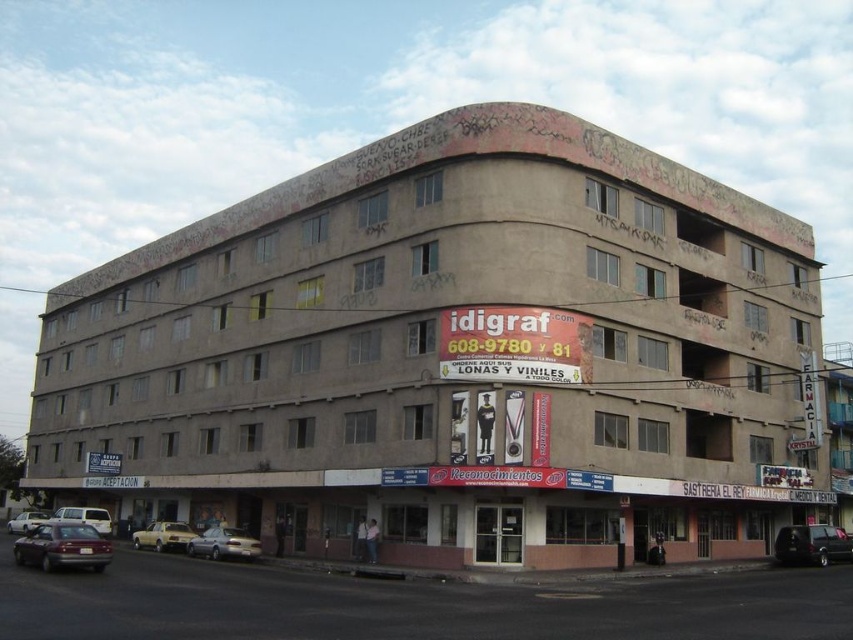
Question: Does shiny black car at lower right come in front of silver metallic car at lower left?

Choices:
 (A) yes
 (B) no

Answer: (A)

Question: Considering the real-world distances, which object is closest to the concrete building at center?

Choices:
 (A) silver metallic car at lower left
 (B) satin silver sedan at lower center

Answer: (B)

Question: Which point is closer to the camera taking this photo?

Choices:
 (A) (825, 536)
 (B) (71, 513)
 (C) (21, 522)
 (D) (584, 129)

Answer: (D)

Question: Is shiny black car at lower right in front of satin silver sedan at lower center?

Choices:
 (A) yes
 (B) no

Answer: (B)

Question: Which point is closer to the camera taking this photo?

Choices:
 (A) (503, 294)
 (B) (22, 554)
 (C) (135, 532)

Answer: (B)

Question: Does concrete building at center have a lesser width compared to silver metallic car at lower left?

Choices:
 (A) no
 (B) yes

Answer: (A)